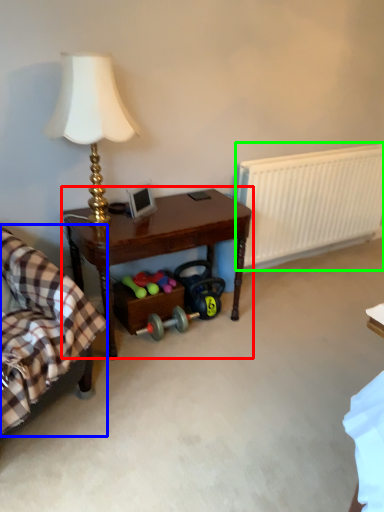
Question: Considering the real-world distances, which object is farthest from table (highlighted by a red box)? rocking chair (highlighted by a blue box) or radiator (highlighted by a green box)?

Choices:
 (A) rocking chair
 (B) radiator

Answer: (B)